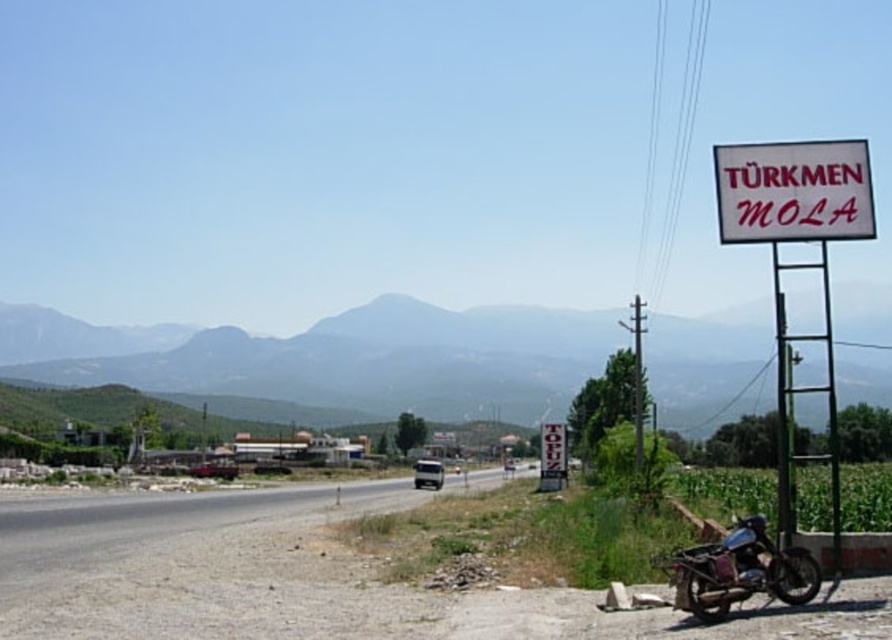
You are a hiker trying to navigate using landmarks. You see the green grassy mountain at upper center and the white plastic sign at upper right. Which one is higher in the image?

The green grassy mountain at upper center is taller than the white plastic sign at upper right.